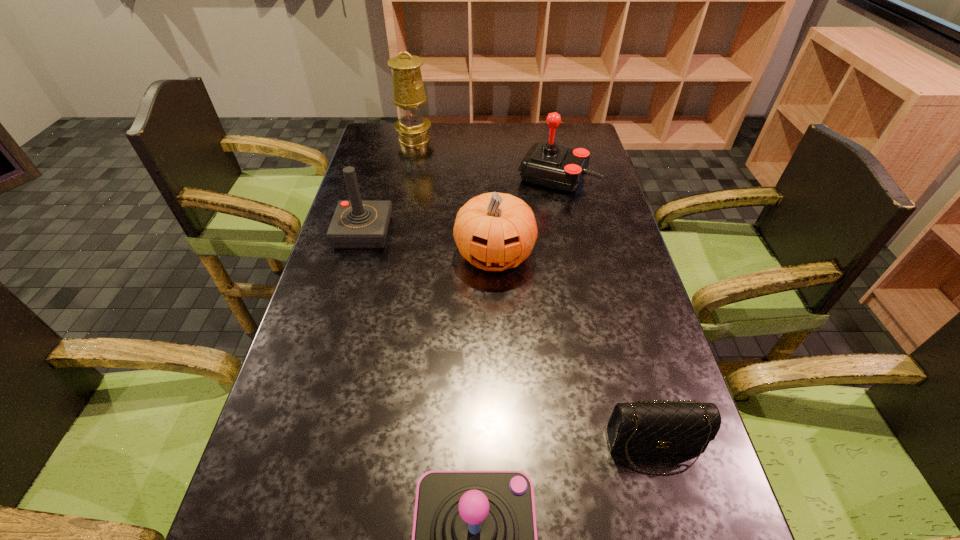
Where is `vacant space at the right edge of the desktop`? This screenshot has width=960, height=540. vacant space at the right edge of the desktop is located at coordinates click(570, 230).

Where is `free location at the far left corner`? This screenshot has height=540, width=960. free location at the far left corner is located at coordinates (365, 147).

Locate an element on the screen. The width and height of the screenshot is (960, 540). vacant space at the far right corner of the desktop is located at coordinates (561, 143).

You are a GUI agent. You are given a task and a screenshot of the screen. Output one action in this format:
    pyautogui.click(x=<x>, y=<y>)
    Task: Click on the free space between the rightmost joystick and the leftmost joystick
    Image resolution: width=960 pixels, height=540 pixels.
    Given the screenshot: What is the action you would take?
    pyautogui.click(x=461, y=205)

This screenshot has height=540, width=960. I want to click on free space between the clutch bag and the oil lamp, so click(535, 293).

The image size is (960, 540). What are the coordinates of `empty space that is in between the pumpkin and the tallest object` in the screenshot? It's located at (454, 197).

Locate an element on the screen. The width and height of the screenshot is (960, 540). vacant point located between the second farthest joystick and the pumpkin is located at coordinates (429, 244).

Find the location of a particular element. The height and width of the screenshot is (540, 960). free space between the second farthest object and the clutch bag is located at coordinates (606, 312).

The width and height of the screenshot is (960, 540). I want to click on empty space that is in between the clutch bag and the pumpkin, so click(574, 351).

Where is `vacant point located between the pumpkin and the clutch bag`? vacant point located between the pumpkin and the clutch bag is located at coordinates (574, 351).